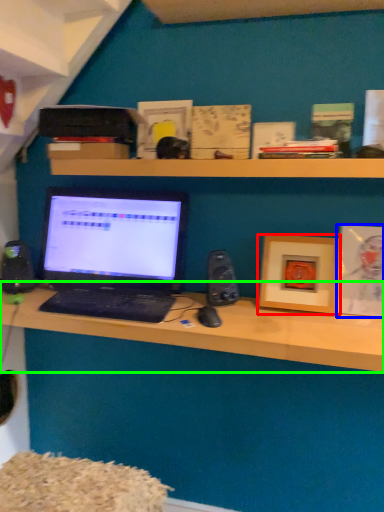
Question: Considering the real-world distances, which object is farthest from picture frame (highlighted by a red box)? picture frame (highlighted by a blue box) or desk (highlighted by a green box)?

Choices:
 (A) picture frame
 (B) desk

Answer: (B)